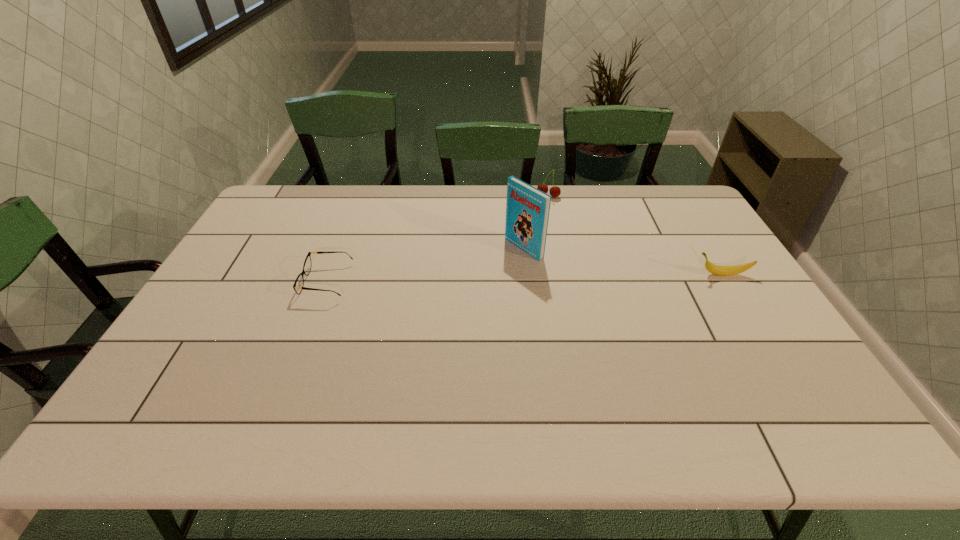
In order to click on vacant area between the third tallest object and the spectacles in this screenshot , I will do `click(524, 278)`.

At what (x,y) coordinates should I click in order to perform the action: click on free space between the leftmost object and the cherry. Please return your answer as a coordinate pair (x, y). Image resolution: width=960 pixels, height=540 pixels. Looking at the image, I should click on tap(438, 239).

You are a GUI agent. You are given a task and a screenshot of the screen. Output one action in this format:
    pyautogui.click(x=<x>, y=<y>)
    Task: Click on the free space between the rightmost object and the spectacles
    This screenshot has width=960, height=540.
    Given the screenshot: What is the action you would take?
    pyautogui.click(x=524, y=278)

Identify which object is located as the nearest to the second tallest object. Please provide its 2D coordinates. Your answer should be formatted as a tuple, i.e. [(x, y)], where the tuple contains the x and y coordinates of a point satisfying the conditions above.

[(527, 209)]

Find the location of a particular element. The image size is (960, 540). object that is the closest to the shortest object is located at coordinates (527, 209).